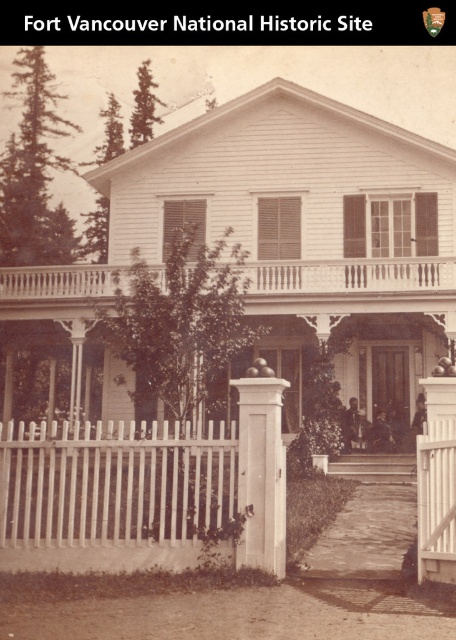
You are standing at the entrance of the Fort Vancouver National Historic Site and notice the white wooden porch at center and the white smooth post at center. Which structure takes up more area in the scene?

The white smooth post at center takes up more area in the scene because the white wooden porch at center occupies less space than it.

You are a visitor at the Fort Vancouver National Historic Site. You notice a white wooden porch at center and a white smooth post at center. Which structure is narrower in width?

The white wooden porch at center is narrower in width compared to the white smooth post at center.